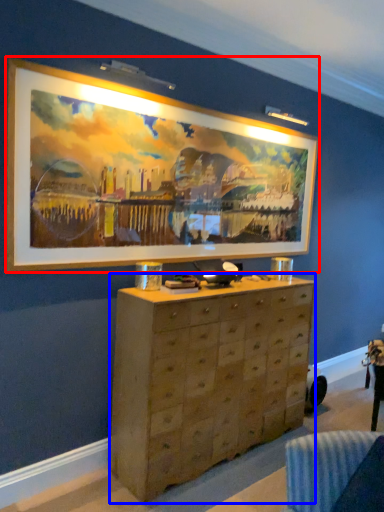
Question: Which object appears closest to the camera in this image, picture frame (highlighted by a red box) or chest of drawers (highlighted by a blue box)?

Choices:
 (A) picture frame
 (B) chest of drawers

Answer: (A)